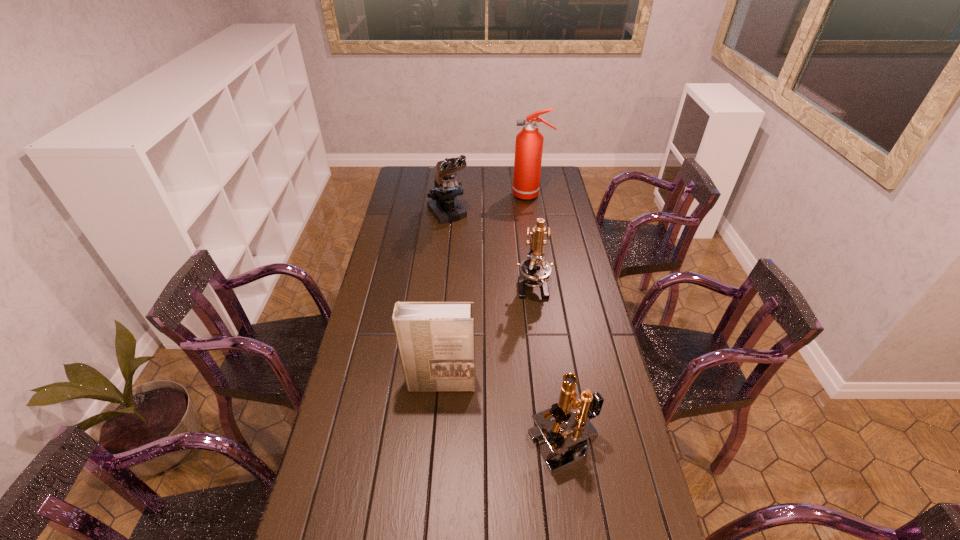
The width and height of the screenshot is (960, 540). In order to click on free space at the far right corner of the desktop in this screenshot , I will do `click(542, 186)`.

Find the location of `vacant area between the fourth farthest object and the nearest microscope`. vacant area between the fourth farthest object and the nearest microscope is located at coordinates (502, 414).

I want to click on vacant area that lies between the nearest microscope and the second nearest object, so click(x=502, y=414).

This screenshot has width=960, height=540. Find the location of `blank region between the second nearest microscope and the farthest microscope`. blank region between the second nearest microscope and the farthest microscope is located at coordinates (490, 249).

Find the location of a particular element. The height and width of the screenshot is (540, 960). empty location between the farthest microscope and the second nearest microscope is located at coordinates (490, 249).

I want to click on free space between the nearest microscope and the tallest object, so click(548, 320).

Where is `unoccupied position between the third farthest object and the second nearest object`? The height and width of the screenshot is (540, 960). unoccupied position between the third farthest object and the second nearest object is located at coordinates (486, 334).

The height and width of the screenshot is (540, 960). In order to click on vacant space in between the second nearest microscope and the phonebook in this screenshot , I will do `click(486, 334)`.

Find the location of a particular element. empty space between the tallest object and the nearest object is located at coordinates pyautogui.click(x=548, y=320).

This screenshot has width=960, height=540. I want to click on vacant space in between the tallest object and the fourth farthest object, so click(x=486, y=289).